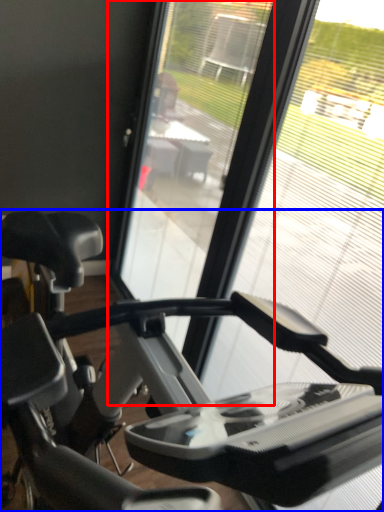
Question: Which of the following is the closest to the observer, screen door (highlighted by a red box) or stationary bicycle (highlighted by a blue box)?

Choices:
 (A) screen door
 (B) stationary bicycle

Answer: (B)